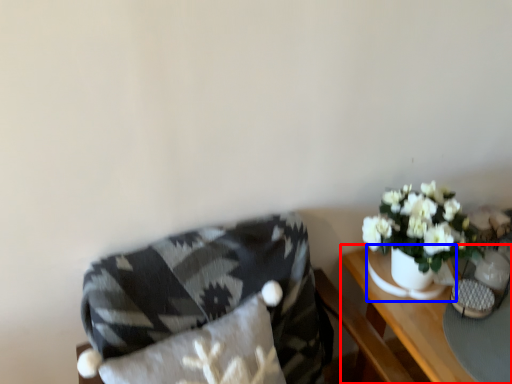
Question: Which point is further to the camera, table (highlighted by a red box) or vase (highlighted by a blue box)?

Choices:
 (A) table
 (B) vase

Answer: (B)